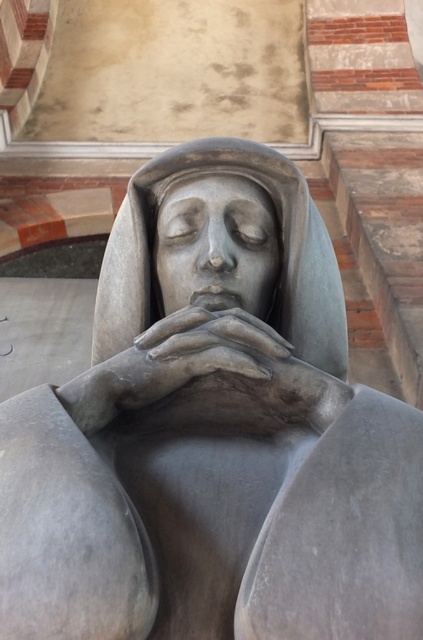
Who is positioned more to the left, matte gray hands at center or matte gray sculpture at center?

matte gray hands at center

Does matte gray hands at center appear under matte gray sculpture at center?

Yes, matte gray hands at center is below matte gray sculpture at center.

Between point (275, 349) and point (172, 214), which one is positioned behind?

The point (172, 214) is behind.

Identify the location of matte gray hands at center. The width and height of the screenshot is (423, 640). (228, 372).

Is satin gray statue at center taller than matte gray hands at center?

Result: Yes.

Does satin gray statue at center come in front of matte gray hands at center?

No, it is not.

Is point (327, 339) more distant than point (213, 376)?

Yes, it is.

This screenshot has width=423, height=640. In order to click on satin gray statue at center in this screenshot , I will do `click(280, 253)`.

I want to click on satin gray statue at center, so click(x=280, y=253).

Is satin gray statue at center to the right of matte gray sculpture at center from the viewer's perspective?

In fact, satin gray statue at center is to the left of matte gray sculpture at center.

You are a GUI agent. You are given a task and a screenshot of the screen. Output one action in this format:
    pyautogui.click(x=<x>, y=<y>)
    Task: Click on the satin gray statue at center
    The image size is (423, 640).
    Given the screenshot: What is the action you would take?
    pyautogui.click(x=280, y=253)

Locate an element on the screen. Image resolution: width=423 pixels, height=640 pixels. satin gray statue at center is located at coordinates (280, 253).